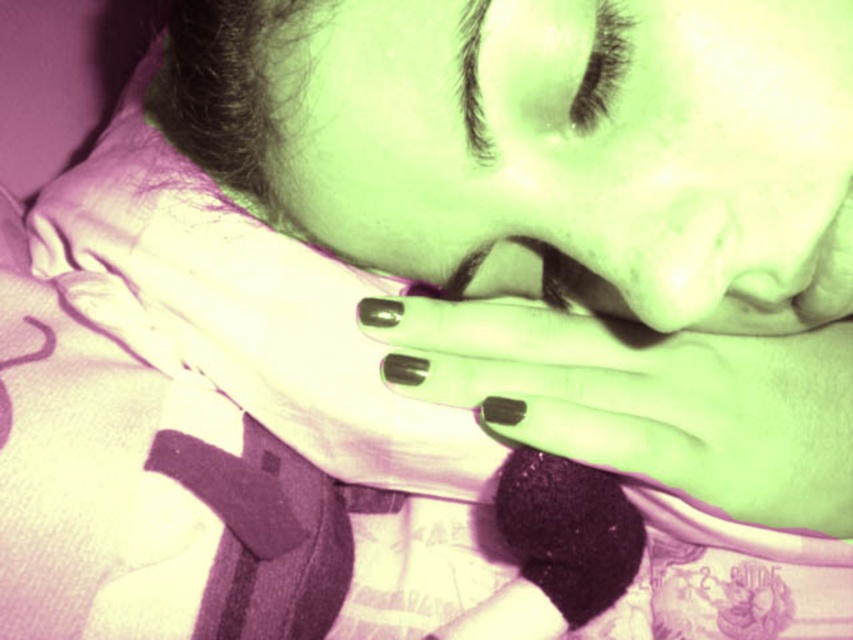
Which is above, matte green skin at center or black eyelashes at upper center?

Positioned higher is black eyelashes at upper center.

Which is behind, point (575, 88) or point (573, 122)?

Positioned behind is point (573, 122).

Find the location of a particular element. The width and height of the screenshot is (853, 640). matte green skin at center is located at coordinates (584, 147).

Can you confirm if matte black nails at center is shorter than black eyelashes at upper center?

Incorrect, matte black nails at center's height does not fall short of black eyelashes at upper center's.

Can you confirm if matte black nails at center is positioned below black eyelashes at upper center?

Correct, matte black nails at center is located below black eyelashes at upper center.

Locate an element on the screen. This screenshot has height=640, width=853. matte black nails at center is located at coordinates (643, 400).

Between point (616, 90) and point (462, 316), which one is positioned behind?

The point (462, 316) is behind.

Does matte green skin at center appear under matte black nails at center?

Incorrect, matte green skin at center is not positioned below matte black nails at center.

Image resolution: width=853 pixels, height=640 pixels. In order to click on matte green skin at center in this screenshot , I will do `click(584, 147)`.